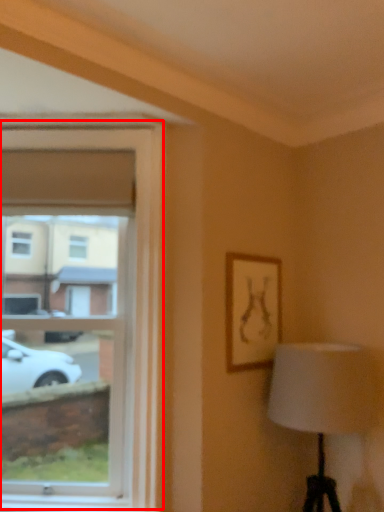
Question: From the image's perspective, what is the correct spatial positioning of window (annotated by the red box) in reference to picture frame?

Choices:
 (A) above
 (B) below

Answer: (A)